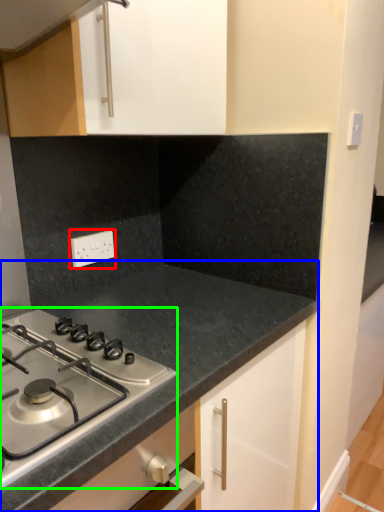
Question: Based on their relative distances, which object is farther from electric outlet (highlighted by a red box)? Choose from countertop (highlighted by a blue box) and gas stove (highlighted by a green box).

Choices:
 (A) countertop
 (B) gas stove

Answer: (B)